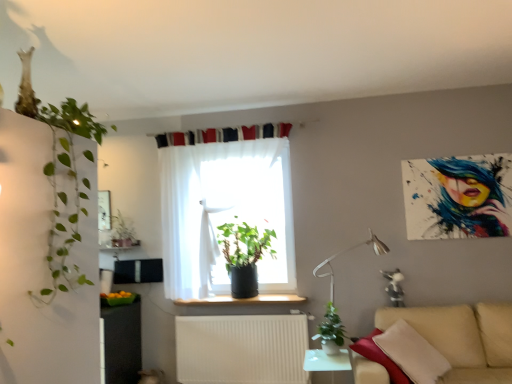
Question: In which direction should I rotate to look at green matte plant at lower center, which is the third houseplant in back-to-front order?

Choices:
 (A) right
 (B) left

Answer: (A)

Question: From a real-world perspective, does sheer white curtain at center stand above green leafy plant at left, which is the first houseplant in front-to-back order?

Choices:
 (A) no
 (B) yes

Answer: (B)

Question: Is green leafy plant at left, which is the first houseplant in front-to-back order, at the back of sheer white curtain at center?

Choices:
 (A) no
 (B) yes

Answer: (A)

Question: From the image's perspective, is sheer white curtain at center above green leafy plant at left, the 4th houseplant viewed from the back?

Choices:
 (A) no
 (B) yes

Answer: (A)

Question: Are sheer white curtain at center and green leafy plant at left, the 4th houseplant viewed from the back, beside each other?

Choices:
 (A) no
 (B) yes

Answer: (A)

Question: Can you confirm if sheer white curtain at center is taller than green leafy plant at left, acting as the third houseplant starting from the right?

Choices:
 (A) no
 (B) yes

Answer: (B)

Question: From the image's perspective, would you say sheer white curtain at center is shown under green leafy plant at left, which is the first houseplant in front-to-back order?

Choices:
 (A) yes
 (B) no

Answer: (A)

Question: Is green leafy plant at left, which is the first houseplant in front-to-back order, shorter than green matte plant at upper left, which is the fourth houseplant in right-to-left order?

Choices:
 (A) yes
 (B) no

Answer: (B)

Question: Is green leafy plant at left, acting as the third houseplant starting from the right, positioned behind green matte plant at upper left, marked as the first houseplant in a left-to-right arrangement?

Choices:
 (A) yes
 (B) no

Answer: (B)

Question: Considering the relative sizes of green leafy plant at left, acting as the third houseplant starting from the right, and green matte plant at upper left, which appears as the fourth houseplant when viewed from the front, in the image provided, is green leafy plant at left, acting as the third houseplant starting from the right, wider than green matte plant at upper left, which appears as the fourth houseplant when viewed from the front,?

Choices:
 (A) yes
 (B) no

Answer: (A)

Question: Is green leafy plant at left, the 4th houseplant viewed from the back, facing towards green matte plant at upper left, which is the fourth houseplant in right-to-left order?

Choices:
 (A) no
 (B) yes

Answer: (A)

Question: Is green leafy plant at left, which is counted as the 2th houseplant, starting from the left, bigger than green matte plant at upper left, which is the 1th houseplant from back to front?

Choices:
 (A) yes
 (B) no

Answer: (A)

Question: Considering the relative sizes of green leafy plant at left, acting as the third houseplant starting from the right, and green matte plant at upper left, which appears as the fourth houseplant when viewed from the front, in the image provided, is green leafy plant at left, acting as the third houseplant starting from the right, smaller than green matte plant at upper left, which appears as the fourth houseplant when viewed from the front,?

Choices:
 (A) yes
 (B) no

Answer: (B)

Question: Does green leafy plant at left, acting as the third houseplant starting from the right, have a smaller size compared to sheer white curtain at center?

Choices:
 (A) no
 (B) yes

Answer: (A)